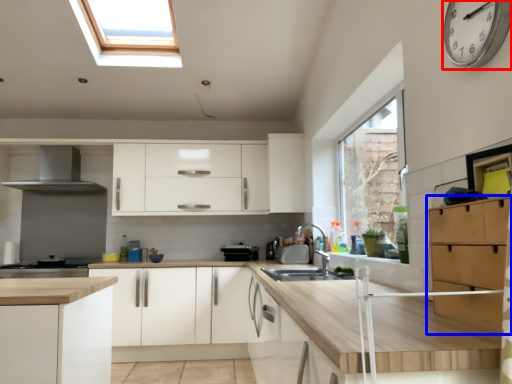
Question: Which point is closer to the camera, clock (highlighted by a red box) or cabinetry (highlighted by a blue box)?

Choices:
 (A) clock
 (B) cabinetry

Answer: (B)